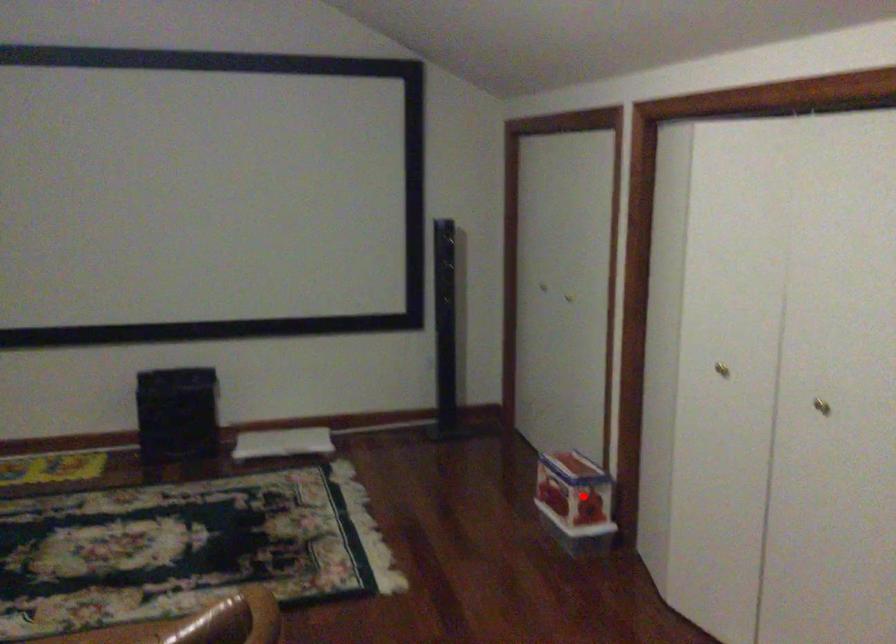
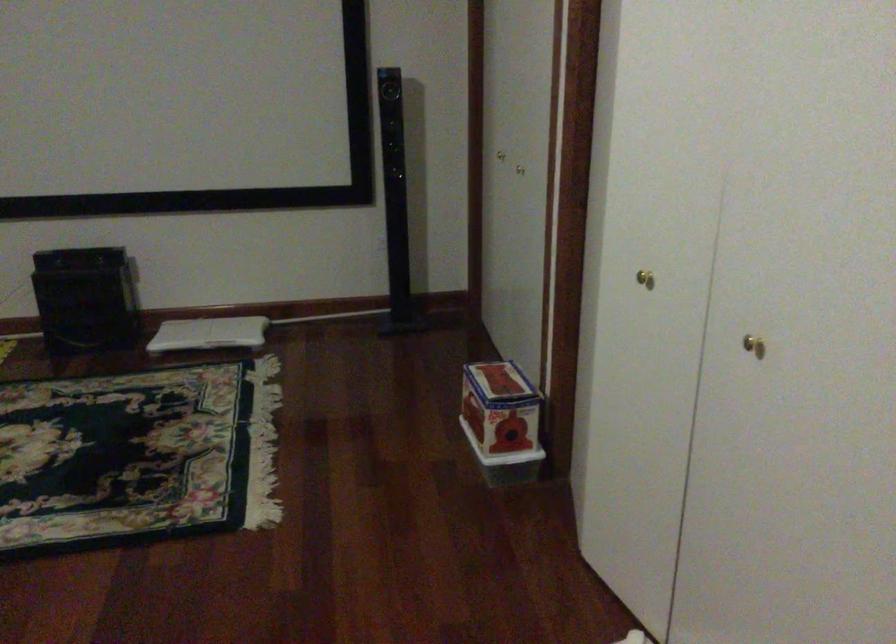
Question: I am providing you with two images of the same scene from different viewpoints. In image1, a red point is highlighted. Considering the same 3D point in image2, which of the following is correct?

Choices:
 (A) It is closer
 (B) It is farther

Answer: (A)